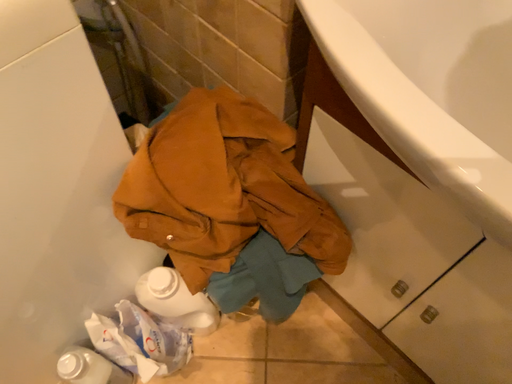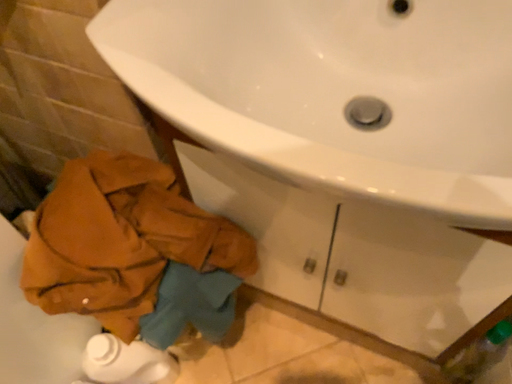
Question: How did the camera likely rotate when shooting the video?

Choices:
 (A) rotated upward
 (B) rotated downward

Answer: (A)